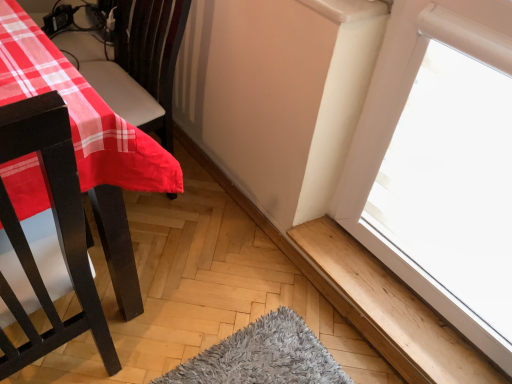
Identify the location of empty space that is to the right of matte plastic table at left. The image size is (512, 384). (217, 230).